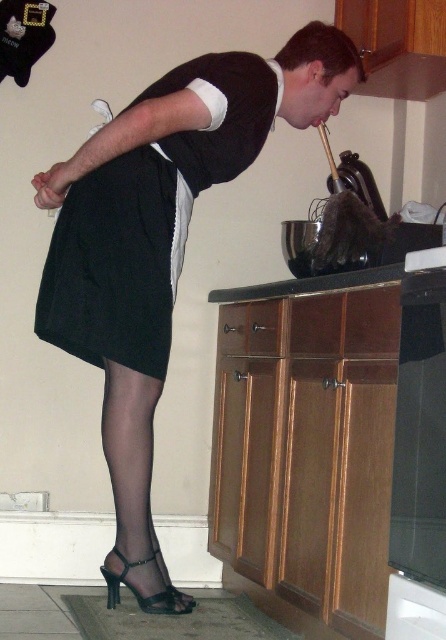
You are a photographer setting up a shot in the kitchen. You have two points marked on your camera screen at coordinates point (144, 442) and point (86, 237). You want to focus on the point that is closer to the camera. Which coordinate should you choose?

Point (86, 237) is closer to the camera than point (144, 442), so you should focus on point (86, 237).

You are a fashion designer observing the image and want to create a new outfit. Based on the positions of the black fabric dress at center and the black sheer stocking at lower left, which item should you consider placing higher up on the body when designing the outfit?

The black fabric dress at center is above the black sheer stocking at lower left in the image, so when designing the outfit, the black fabric dress at center should be placed higher up on the body since it is positioned above the stocking.